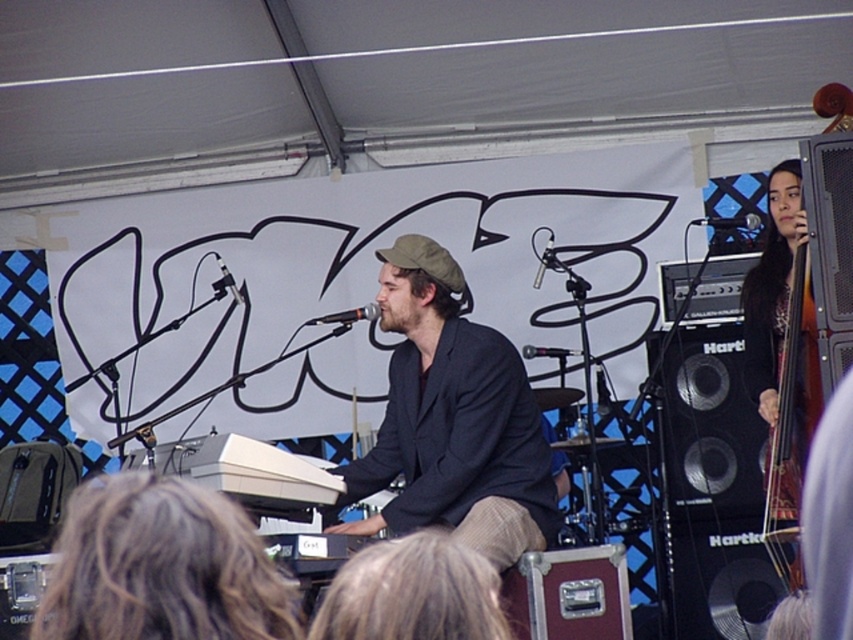
Question: Is the position of brown hair at lower left less distant than that of black metallic microphone at center?

Choices:
 (A) yes
 (B) no

Answer: (A)

Question: Among these points, which one is nearest to the camera?

Choices:
 (A) (339, 317)
 (B) (521, 353)
 (C) (535, 273)
 (D) (424, 605)

Answer: (D)

Question: Does black metallic microphone at upper center appear on the right side of black matte microphone at center?

Choices:
 (A) no
 (B) yes

Answer: (B)

Question: Is black metallic microphone at center in front of black matte microphone at center?

Choices:
 (A) no
 (B) yes

Answer: (B)

Question: Which of the following is the closest to the observer?

Choices:
 (A) black matte microphone at upper center
 (B) black metallic microphone at center
 (C) black matte microphone at center
 (D) black metallic microphone at upper center

Answer: (B)

Question: Based on their relative distances, which object is farther from the black matte microphone at center?

Choices:
 (A) brown hair at lower left
 (B) black metallic microphone at center

Answer: (A)